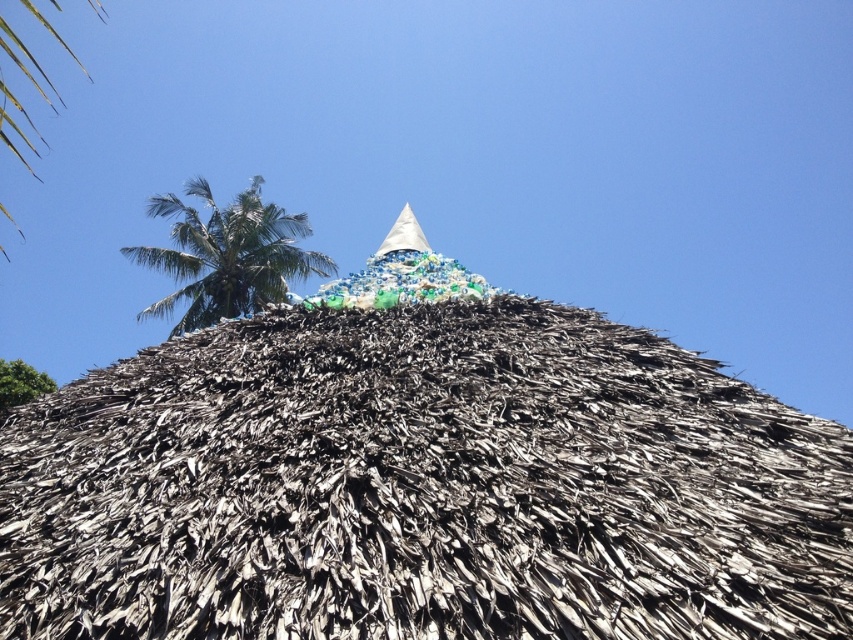
Question: Does brown thatch roof at center have a larger size compared to green leafy palm tree at upper left?

Choices:
 (A) no
 (B) yes

Answer: (A)

Question: Which object appears farthest from the camera in this image?

Choices:
 (A) brown thatch roof at center
 (B) green leafy palm tree at upper left

Answer: (B)

Question: Which object appears closest to the camera in this image?

Choices:
 (A) green leafy palm tree at upper left
 (B) brown thatch roof at center

Answer: (B)

Question: Which of the following is the closest to the observer?

Choices:
 (A) brown thatch roof at center
 (B) green leafy palm tree at upper left

Answer: (A)

Question: Can you confirm if brown thatch roof at center is thinner than green leafy palm tree at upper left?

Choices:
 (A) yes
 (B) no

Answer: (A)

Question: Observing the image, what is the correct spatial positioning of brown thatch roof at center in reference to green leafy palm tree at upper left?

Choices:
 (A) above
 (B) below

Answer: (B)